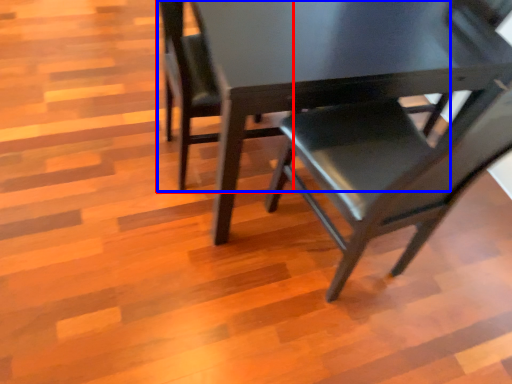
Question: Which of the following is the closest to the observer, chair (highlighted by a red box) or chair (highlighted by a blue box)?

Choices:
 (A) chair
 (B) chair

Answer: (B)